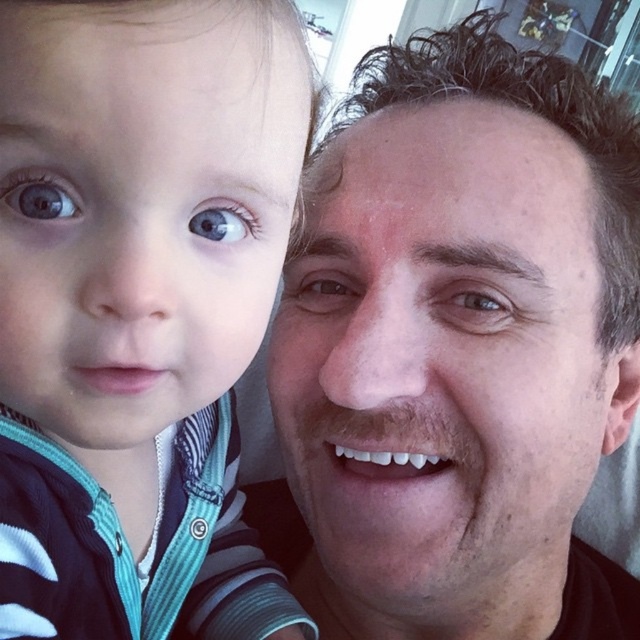
Is blue glossy eye at left above brown matte eye at center?

Yes, blue glossy eye at left is above brown matte eye at center.

Consider the image. Who is more forward, (61, 212) or (349, 291)?

Point (61, 212) is in front.

Is point (52, 182) positioned before point (307, 289)?

Yes, it is.

Where is `blue glossy eye at left`? The width and height of the screenshot is (640, 640). blue glossy eye at left is located at coordinates (38, 195).

Who is positioned more to the right, smooth skin face at upper right or striped fabric baby at left?

From the viewer's perspective, smooth skin face at upper right appears more on the right side.

Does smooth skin face at upper right have a smaller size compared to striped fabric baby at left?

No.

Locate an element on the screen. This screenshot has width=640, height=640. smooth skin face at upper right is located at coordinates (461, 346).

I want to click on smooth skin face at upper right, so click(461, 346).

Does smooth skin face at upper right have a greater width compared to brown matte eye at center?

Correct, the width of smooth skin face at upper right exceeds that of brown matte eye at center.

Is smooth skin face at upper right thinner than brown matte eye at center?

In fact, smooth skin face at upper right might be wider than brown matte eye at center.

The width and height of the screenshot is (640, 640). What do you see at coordinates (461, 346) in the screenshot?
I see `smooth skin face at upper right` at bounding box center [461, 346].

Find the location of a particular element. The width and height of the screenshot is (640, 640). smooth skin face at upper right is located at coordinates (461, 346).